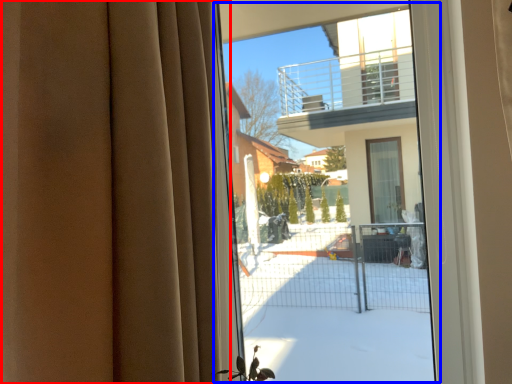
Question: Among these objects, which one is farthest to the camera, curtain (highlighted by a red box) or bay window (highlighted by a blue box)?

Choices:
 (A) curtain
 (B) bay window

Answer: (B)